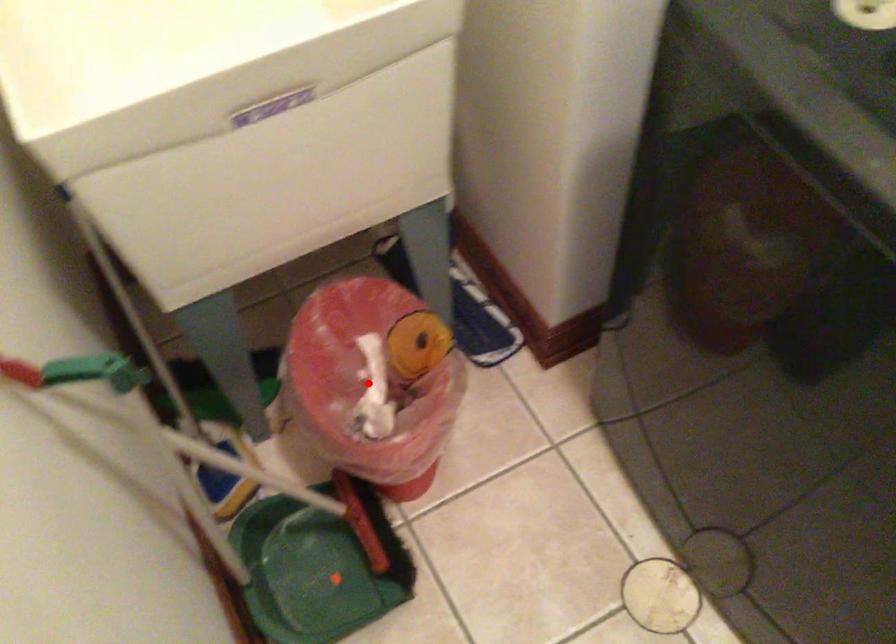
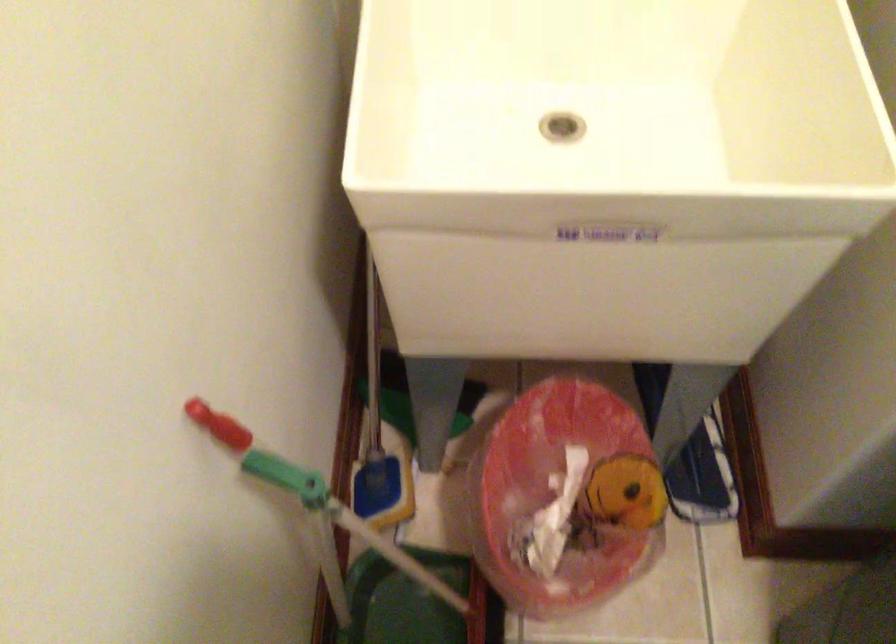
Where in the second image is the point corresponding to the highlighted location from the first image?

(555, 496)